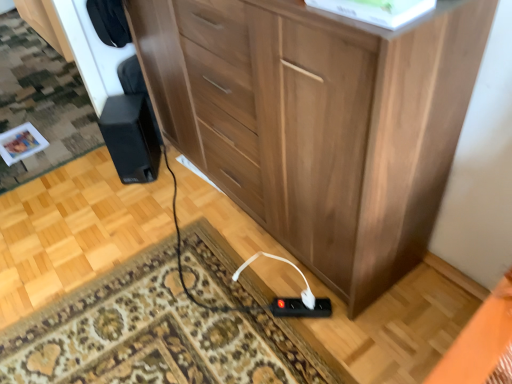
The image size is (512, 384). In order to click on free space in front of black matte speaker at lower left in this screenshot , I will do `click(139, 198)`.